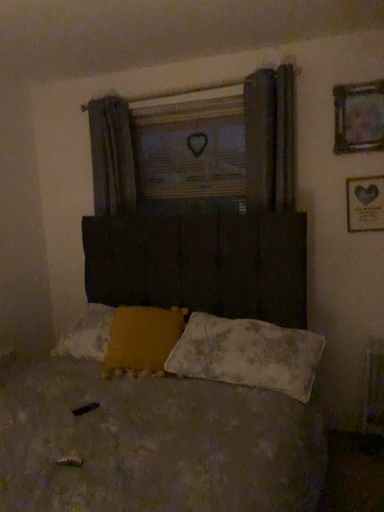
Question: Looking at their shapes, would you say wooden heart at center is wider or thinner than worn fabric pillow at lower center, the first pillow viewed from the right?

Choices:
 (A) wide
 (B) thin

Answer: (B)

Question: Considering the positions of wooden heart at center and worn fabric pillow at lower center, arranged as the 2th pillow when viewed from the left, in the image, is wooden heart at center taller or shorter than worn fabric pillow at lower center, arranged as the 2th pillow when viewed from the left,?

Choices:
 (A) tall
 (B) short

Answer: (A)

Question: Estimate the real-world distances between objects in this image. Which object is closer to the wooden heart at center?

Choices:
 (A) worn fabric pillow at lower center, the first pillow viewed from the right
 (B) gold metallic picture frame at upper right, the 1th picture frame positioned from the bottom
 (C) yellow fuzzy pillow at lower center, which is the first pillow from left to right
 (D) worn fabric bed at center
 (E) metallic silver picture frame at upper right, the 1th picture frame from the top

Answer: (E)

Question: Based on their relative distances, which object is farther from the yellow fuzzy pillow at lower center, which is the first pillow from left to right?

Choices:
 (A) gold metallic picture frame at upper right, which is the 2th picture frame in top-to-bottom order
 (B) worn fabric pillow at lower center, arranged as the 2th pillow when viewed from the left
 (C) worn fabric bed at center
 (D) metallic silver picture frame at upper right, the 1th picture frame from the top
 (E) wooden heart at center

Answer: (D)